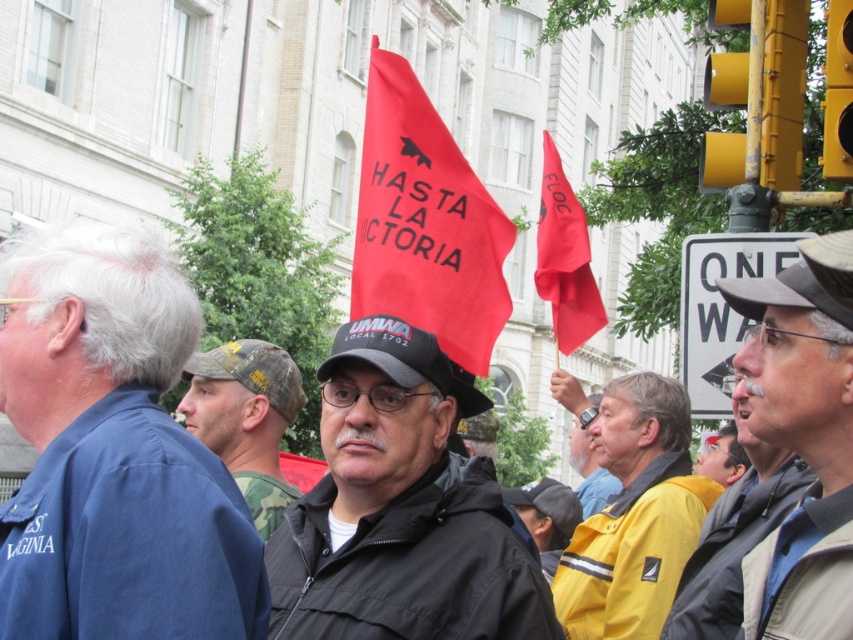
Who is more distant from viewer, (566, 554) or (253, 426)?

The point (253, 426) is behind.

Who is lower down, yellow fabric jacket at center or camo fabric cap at center?

yellow fabric jacket at center

Who is more forward, (653, 483) or (271, 465)?

Point (653, 483)

The width and height of the screenshot is (853, 640). Find the location of `yellow fabric jacket at center`. yellow fabric jacket at center is located at coordinates (634, 515).

Which of these two, gray fabric cap at upper center or yellow fabric jacket at center, stands taller?

With more height is gray fabric cap at upper center.

Which is in front, point (813, 582) or point (566, 595)?

Point (813, 582) is more forward.

Identify the location of gray fabric cap at upper center. The height and width of the screenshot is (640, 853). (804, 440).

Is gray fabric jacket at center to the right of yellow fabric at center from the viewer's perspective?

In fact, gray fabric jacket at center is to the left of yellow fabric at center.

Based on the photo, which is more to the left, gray fabric jacket at center or yellow fabric at center?

Positioned to the left is gray fabric jacket at center.

Find the location of a particular element. The height and width of the screenshot is (640, 853). gray fabric jacket at center is located at coordinates (734, 534).